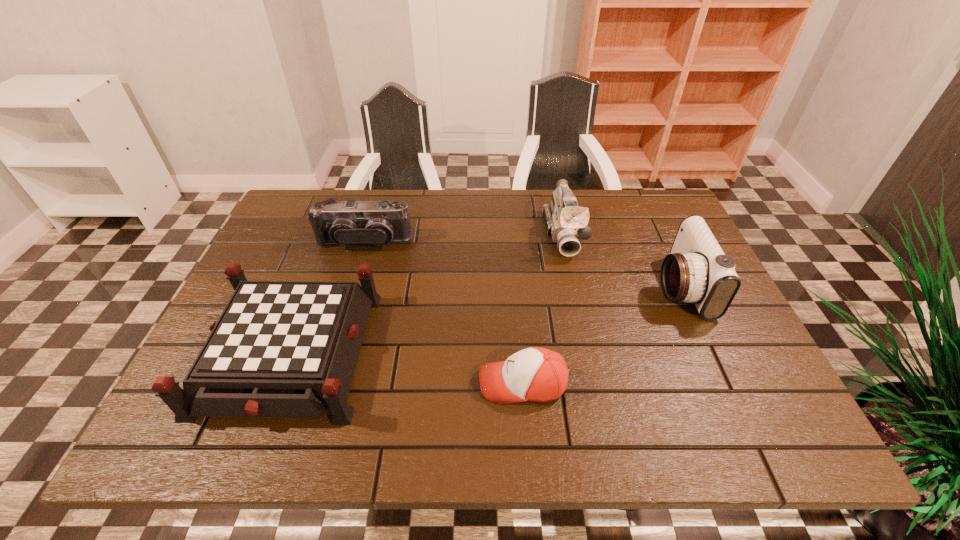
I want to click on vacant area situated on the front-facing side of the leftmost camcorder, so click(x=342, y=319).

Identify the location of vacant point located 0.360m on the right of the checkerboard. The width and height of the screenshot is (960, 540). (533, 353).

Locate an element on the screen. The height and width of the screenshot is (540, 960). free spot located 0.120m on the front-facing side of the baseball cap is located at coordinates (421, 383).

The height and width of the screenshot is (540, 960). Identify the location of free point located on the front-facing side of the baseball cap. (329, 383).

Where is `vacant space located on the front-facing side of the baseball cap`? The height and width of the screenshot is (540, 960). vacant space located on the front-facing side of the baseball cap is located at coordinates (339, 383).

Identify the location of checkerboard that is at the near edge. (280, 348).

I want to click on baseball cap that is at the near edge, so (535, 374).

At what (x,y) coordinates should I click in order to perform the action: click on camcorder that is at the left edge. Please return your answer as a coordinate pair (x, y). Looking at the image, I should click on (349, 222).

Identify the location of checkerboard present at the left edge. This screenshot has height=540, width=960. (280, 348).

The width and height of the screenshot is (960, 540). In order to click on object situated at the right edge in this screenshot , I will do `click(697, 271)`.